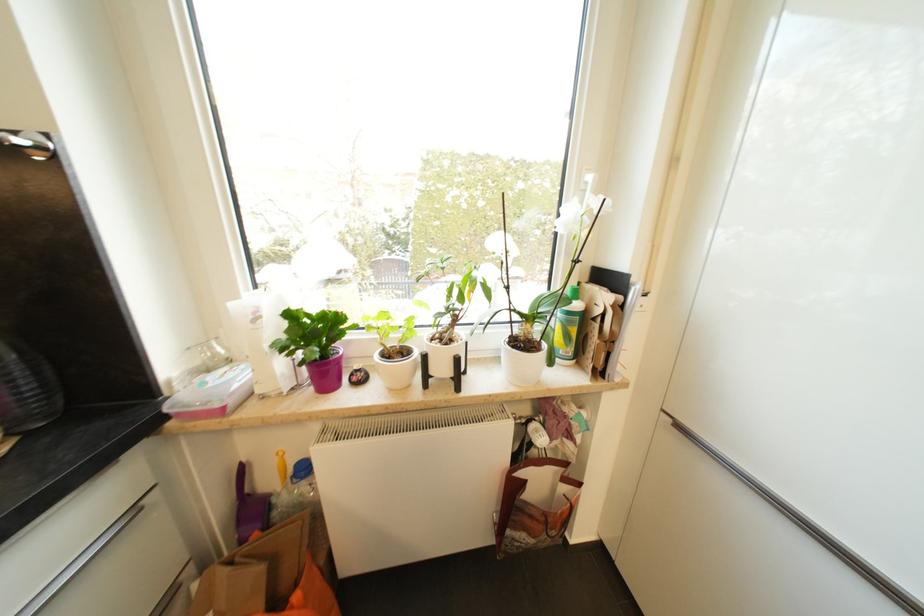
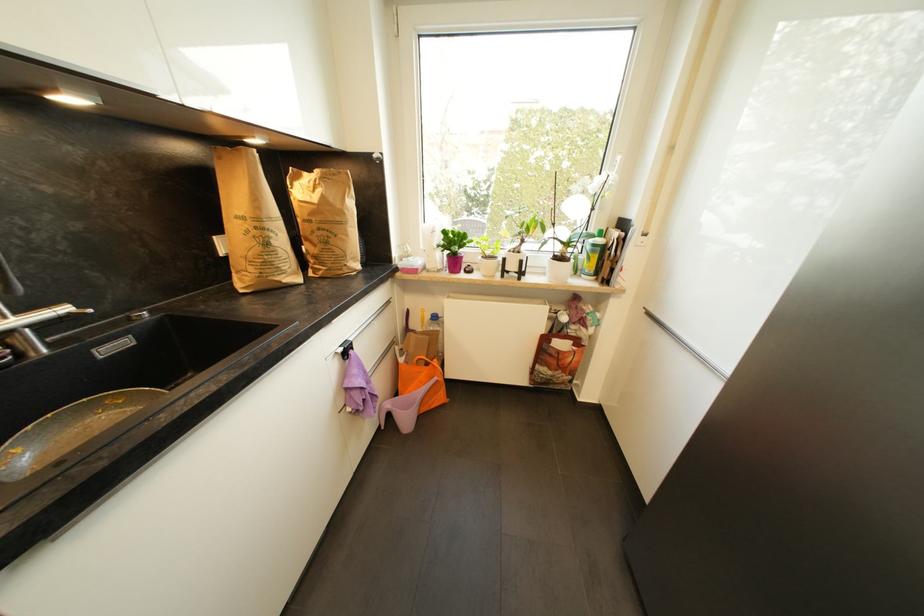
In the second image, find the point that corresponds to (x=541, y=350) in the first image.

(570, 261)